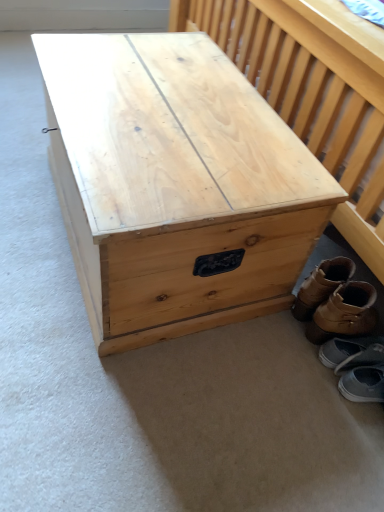
Question: Is brown leather boot at lower right, which is counted as the second footwear, starting from the top, bigger or smaller than natural wood trunk at center?

Choices:
 (A) big
 (B) small

Answer: (B)

Question: In the image, is brown leather boot at lower right, which is counted as the second footwear, starting from the top, on the left side or the right side of natural wood trunk at center?

Choices:
 (A) left
 (B) right

Answer: (B)

Question: Estimate the real-world distances between objects in this image. Which object is farther from the gray suede shoes at lower right, placed as the 1th footwear when sorted from bottom to top?

Choices:
 (A) brown leather boot at lower right, which is counted as the second footwear, starting from the top
 (B) brown leather boots at lower right, which ranks as the 4th footwear in bottom-to-top order
 (C) gray fabric shoe at lower right, the 2th footwear ordered from the bottom
 (D) natural wood trunk at center

Answer: (D)

Question: Based on their relative distances, which object is farther from the brown leather boots at lower right, which ranks as the 4th footwear in bottom-to-top order?

Choices:
 (A) gray suede shoes at lower right, placed as the 1th footwear when sorted from bottom to top
 (B) brown leather boot at lower right, which is counted as the 3th footwear, starting from the bottom
 (C) natural wood trunk at center
 (D) gray fabric shoe at lower right, the 2th footwear ordered from the bottom

Answer: (C)